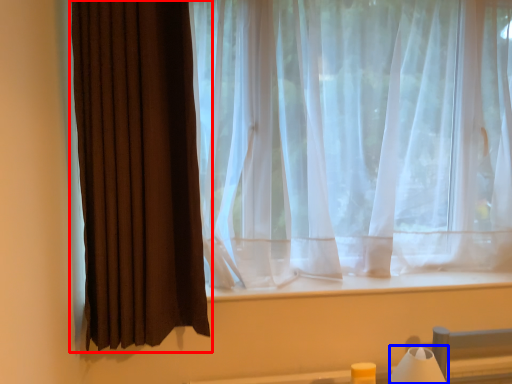
Question: Which object is further to the camera taking this photo, curtain (highlighted by a red box) or table lamp (highlighted by a blue box)?

Choices:
 (A) curtain
 (B) table lamp

Answer: (B)